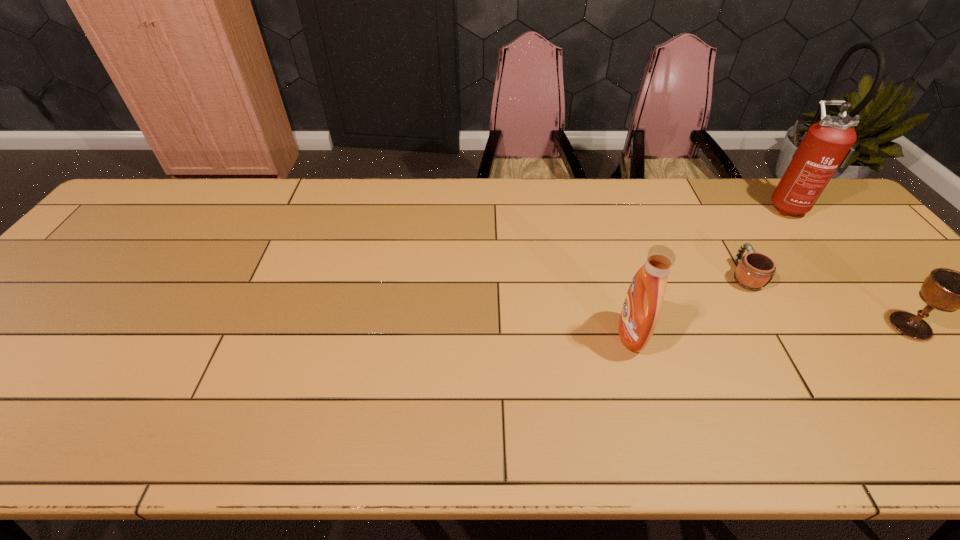
I want to click on free spot between the third object from right to left and the chalice, so click(x=828, y=301).

Identify the location of vacant area that lies between the farthest object and the shortest object. Image resolution: width=960 pixels, height=540 pixels. (765, 240).

Find the location of a particular element. The width and height of the screenshot is (960, 540). free area in between the shortest object and the leftmost object is located at coordinates (687, 305).

Locate an element on the screen. free space between the chalice and the mug is located at coordinates (828, 301).

This screenshot has height=540, width=960. I want to click on free area in between the third object from right to left and the farthest object, so pos(765,240).

The width and height of the screenshot is (960, 540). In order to click on free space between the tallest object and the second shortest object in this screenshot , I will do `click(849, 265)`.

This screenshot has height=540, width=960. Find the location of `free spot between the chalice and the leftmost object`. free spot between the chalice and the leftmost object is located at coordinates (771, 330).

Where is `object that is the second closest one to the leftmost object`? The height and width of the screenshot is (540, 960). object that is the second closest one to the leftmost object is located at coordinates [x=947, y=290].

Locate an element on the screen. Image resolution: width=960 pixels, height=540 pixels. the third closest object to the leftmost object is located at coordinates (826, 145).

Identify the location of vacant space that satisfies the following two spatial constraints: 1. on the front side of the second shortest object; 2. on the front-facing side of the leftmost object. (919, 335).